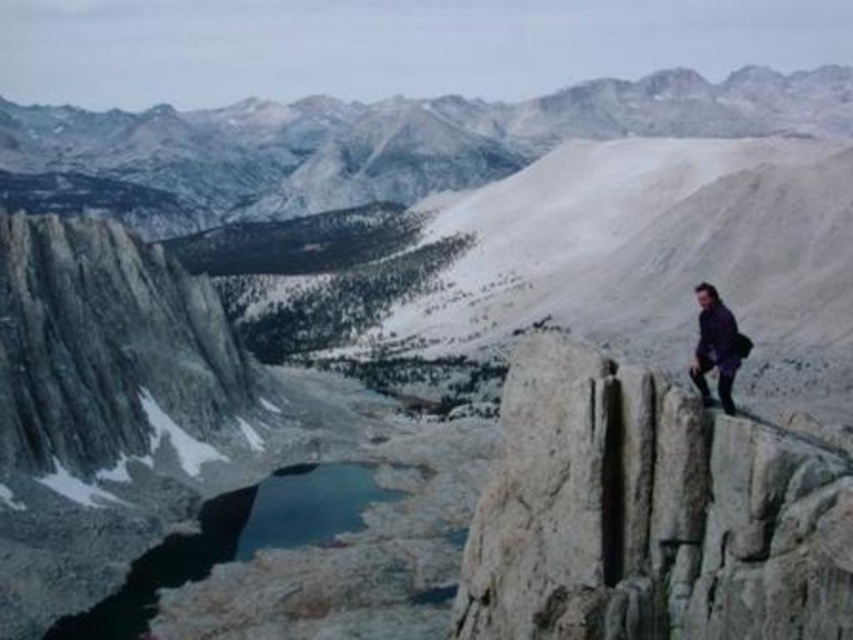
Is white rough rock at right above purple matte jacket at right?

Incorrect, white rough rock at right is not positioned above purple matte jacket at right.

Who is more distant from viewer, (833, 504) or (724, 330)?

Positioned behind is point (724, 330).

Where is `white rough rock at right`? The height and width of the screenshot is (640, 853). white rough rock at right is located at coordinates (648, 515).

Can you confirm if white rough rock at right is thinner than blue glassy lake at lower left?

Yes.

Between white rough rock at right and blue glassy lake at lower left, which one is positioned higher?

Positioned higher is white rough rock at right.

Which is in front, point (699, 554) or point (61, 628)?

Point (699, 554)

Image resolution: width=853 pixels, height=640 pixels. Identify the location of white rough rock at right. (648, 515).

Does point (125, 616) lie behind point (721, 346)?

Yes, point (125, 616) is behind point (721, 346).

This screenshot has height=640, width=853. Describe the element at coordinates (233, 540) in the screenshot. I see `blue glassy lake at lower left` at that location.

Find the location of a particular element. blue glassy lake at lower left is located at coordinates (233, 540).